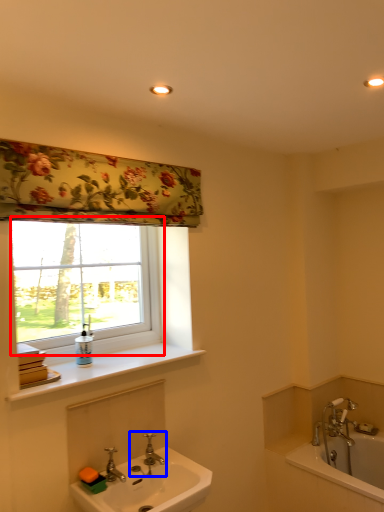
Question: Among these objects, which one is nearest to the camera, window (highlighted by a red box) or tap (highlighted by a blue box)?

Choices:
 (A) window
 (B) tap

Answer: (B)